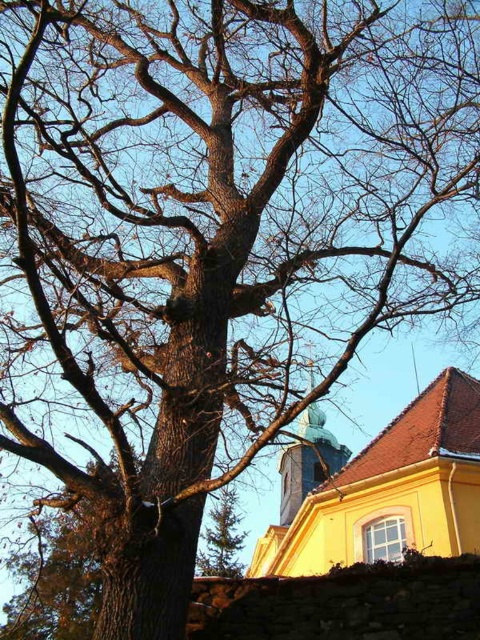
Question: Which is nearer to the yellow matte church at upper center?

Choices:
 (A) green textured pine tree at center
 (B) light brown stone tower at center

Answer: (B)

Question: Can you confirm if light brown stone tower at center is smaller than green textured pine tree at center?

Choices:
 (A) no
 (B) yes

Answer: (A)

Question: Which is farther from the light brown stone tower at center?

Choices:
 (A) green textured pine tree at center
 (B) yellow matte church at upper center

Answer: (A)

Question: Which object is closer to the camera taking this photo?

Choices:
 (A) yellow matte church at upper center
 (B) light brown stone tower at center
 (C) green textured pine tree at center

Answer: (B)

Question: Does light brown stone tower at center come behind green textured pine tree at center?

Choices:
 (A) no
 (B) yes

Answer: (A)

Question: Can you confirm if yellow matte church at upper center is positioned below green textured pine tree at center?

Choices:
 (A) yes
 (B) no

Answer: (B)